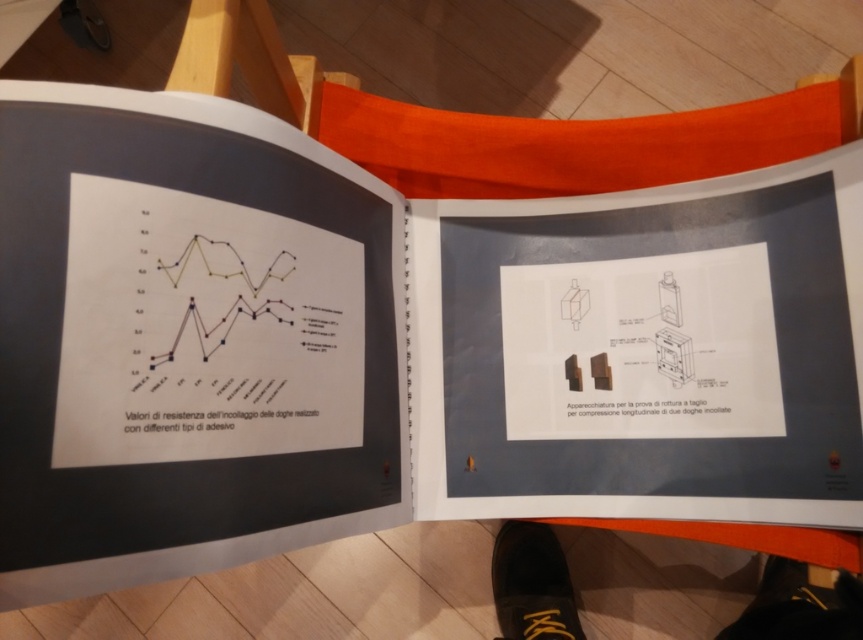
Question: Does black leather shoe at lower right appear under black leather shoe at lower center?

Choices:
 (A) yes
 (B) no

Answer: (B)

Question: Can you confirm if black leather shoe at lower right is positioned above black leather shoe at lower center?

Choices:
 (A) no
 (B) yes

Answer: (B)

Question: Which point appears farthest from the camera in this image?

Choices:
 (A) (536, 540)
 (B) (823, 616)

Answer: (A)

Question: From the image, what is the correct spatial relationship of black leather shoe at lower right in relation to black leather shoe at lower center?

Choices:
 (A) below
 (B) above

Answer: (B)

Question: Which point appears closest to the camera in this image?

Choices:
 (A) (540, 580)
 (B) (498, 586)

Answer: (A)